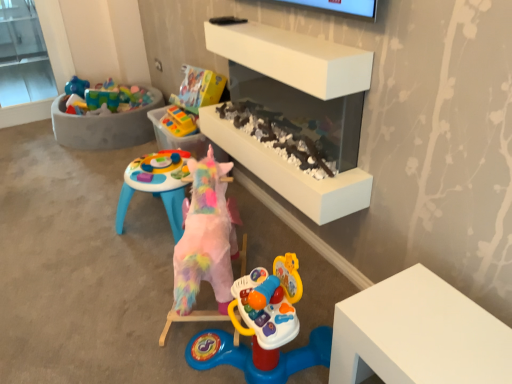
This screenshot has height=384, width=512. What do you see at coordinates (293, 58) in the screenshot?
I see `white matte fireplace at center` at bounding box center [293, 58].

What do you see at coordinates (205, 244) in the screenshot? I see `fuzzy pink unicorn at center, which is the second toy in back-to-front order` at bounding box center [205, 244].

Identify the location of white matte fireplace at center. (293, 58).

Locate an element on the screen. furniture that is on the left side of white matte fireplace at center is located at coordinates (104, 126).

Which object is closer to the camera, white matte fireplace at center or concrete tub at upper left?

white matte fireplace at center.

Considering the points (246, 144) and (151, 93), which point is in front, point (246, 144) or point (151, 93)?

Positioned in front is point (246, 144).

Does white matte fireplace at center have a lesser width compared to concrete tub at upper left?

Yes.

From a real-world perspective, which is physically below, fuzzy pink unicorn at center, positioned as the 1th toy in front-to-back order, or rubberized plastic toy at center, the 1th toy in the top-to-bottom sequence?

From a 3D spatial view, fuzzy pink unicorn at center, positioned as the 1th toy in front-to-back order, is below.

Is fuzzy pink unicorn at center, arranged as the first toy when ordered from the bottom, oriented towards rubberized plastic toy at center, the second toy positioned from the front?

No, fuzzy pink unicorn at center, arranged as the first toy when ordered from the bottom, does not turn towards rubberized plastic toy at center, the second toy positioned from the front.

Between fuzzy pink unicorn at center, positioned as the 1th toy in front-to-back order, and rubberized plastic toy at center, the 1th toy in the top-to-bottom sequence, which one has more height?

fuzzy pink unicorn at center, positioned as the 1th toy in front-to-back order, is taller.

Is fuzzy pink unicorn at center, positioned as the 1th toy in front-to-back order, to the left of rubberized plastic toy at center, which is the second toy from bottom to top, from the viewer's perspective?

In fact, fuzzy pink unicorn at center, positioned as the 1th toy in front-to-back order, is to the right of rubberized plastic toy at center, which is the second toy from bottom to top.

Which is less distant, (152, 92) or (266, 159)?

Clearly, point (152, 92) is more distant from the camera than point (266, 159).

Could white matte fireplace at center be considered to be inside concrete tub at upper left?

No, white matte fireplace at center is not surrounded by concrete tub at upper left.

Is concrete tub at upper left in front of white matte fireplace at center?

No, concrete tub at upper left is behind white matte fireplace at center.

Does concrete tub at upper left appear on the right side of white matte fireplace at center?

In fact, concrete tub at upper left is to the left of white matte fireplace at center.

From a real-world perspective, between fuzzy pink unicorn at center, the 2th toy when ordered from top to bottom, and concrete tub at upper left, who is vertically lower?

In real-world perspective, concrete tub at upper left is lower.

Consider the image. From the image's perspective, who appears lower, fuzzy pink unicorn at center, the 2th toy when ordered from top to bottom, or concrete tub at upper left?

From the image's view, fuzzy pink unicorn at center, the 2th toy when ordered from top to bottom, is below.

Who is more distant, fuzzy pink unicorn at center, positioned as the 1th toy in front-to-back order, or concrete tub at upper left?

Positioned behind is concrete tub at upper left.

Based on their sizes in the image, would you say concrete tub at upper left is bigger or smaller than fuzzy pink unicorn at center, the 2th toy when ordered from top to bottom?

Clearly, concrete tub at upper left is larger in size than fuzzy pink unicorn at center, the 2th toy when ordered from top to bottom.

What's the angular difference between concrete tub at upper left and fuzzy pink unicorn at center, the 2th toy when ordered from top to bottom,'s facing directions?

29.8 degrees separate the facing orientations of concrete tub at upper left and fuzzy pink unicorn at center, the 2th toy when ordered from top to bottom.

From the image's perspective, count 2nd toys downward from the concrete tub at upper left and point to it. Please provide its 2D coordinates.

[(205, 244)]

Looking at this image, is the surface of concrete tub at upper left in direct contact with fuzzy pink unicorn at center, positioned as the 1th toy in front-to-back order?

No, concrete tub at upper left is not making contact with fuzzy pink unicorn at center, positioned as the 1th toy in front-to-back order.

Is rubberized plastic toy at center, the second toy positioned from the front, located outside concrete tub at upper left?

Indeed, rubberized plastic toy at center, the second toy positioned from the front, is completely outside concrete tub at upper left.

Are rubberized plastic toy at center, which is the first toy in back-to-front order, and concrete tub at upper left making contact?

No, rubberized plastic toy at center, which is the first toy in back-to-front order, is not with concrete tub at upper left.

Measure the distance between rubberized plastic toy at center, which is the first toy in back-to-front order, and concrete tub at upper left.

They are 32.30 inches apart.

Locate an element on the screen. toy behind the white matte fireplace at center is located at coordinates (179, 122).

Considering the relative positions of white matte fireplace at center and rubberized plastic toy at center, which is the first toy in back-to-front order, in the image provided, is white matte fireplace at center to the left or to the right of rubberized plastic toy at center, which is the first toy in back-to-front order,?

From the image, it's evident that white matte fireplace at center is to the right of rubberized plastic toy at center, which is the first toy in back-to-front order.

From the image's perspective, is white matte fireplace at center beneath rubberized plastic toy at center, the second toy positioned from the front?

Yes, from the image's perspective, white matte fireplace at center is beneath rubberized plastic toy at center, the second toy positioned from the front.

Locate an element on the screen. Image resolution: width=512 pixels, height=384 pixels. furniture lying on the left of white matte fireplace at center is located at coordinates (104, 126).

Where is `toy lying in front of the rubberized plastic toy at center, the second toy positioned from the front`? Image resolution: width=512 pixels, height=384 pixels. toy lying in front of the rubberized plastic toy at center, the second toy positioned from the front is located at coordinates (205, 244).

Looking at this image, when comparing their distances from rubberized plastic toy at center, the second toy positioned from the front, does fuzzy pink unicorn at center, the 2th toy when ordered from top to bottom, or white matte fireplace at center seem further?

The object further to rubberized plastic toy at center, the second toy positioned from the front, is fuzzy pink unicorn at center, the 2th toy when ordered from top to bottom.

Based on their spatial positions, is rubberized plastic toy at center, which is the first toy in back-to-front order, or fuzzy pink unicorn at center, which is the second toy in back-to-front order, closer to white matte fireplace at center?

fuzzy pink unicorn at center, which is the second toy in back-to-front order.

Which object lies further to the anchor point fuzzy pink unicorn at center, arranged as the first toy when ordered from the bottom, white matte fireplace at center or rubberized plastic toy at center, the 1th toy in the top-to-bottom sequence?

The object further to fuzzy pink unicorn at center, arranged as the first toy when ordered from the bottom, is rubberized plastic toy at center, the 1th toy in the top-to-bottom sequence.

Looking at the image, which one is located closer to rubberized plastic toy at center, the second toy positioned from the front, concrete tub at upper left or fuzzy pink unicorn at center, which is the second toy in back-to-front order?

concrete tub at upper left is closer to rubberized plastic toy at center, the second toy positioned from the front.

When comparing their distances from fuzzy pink unicorn at center, arranged as the first toy when ordered from the bottom, does rubberized plastic toy at center, the 1th toy in the top-to-bottom sequence, or concrete tub at upper left seem further?

concrete tub at upper left.

Estimate the real-world distances between objects in this image. Which object is further from white matte fireplace at center, rubberized plastic toy at center, which is the second toy from bottom to top, or concrete tub at upper left?

Among the two, concrete tub at upper left is located further to white matte fireplace at center.

Estimate the real-world distances between objects in this image. Which object is further from fuzzy pink unicorn at center, the 2th toy when ordered from top to bottom, concrete tub at upper left or white matte fireplace at center?

concrete tub at upper left is further to fuzzy pink unicorn at center, the 2th toy when ordered from top to bottom.

When comparing their distances from fuzzy pink unicorn at center, the 2th toy when ordered from top to bottom, does white matte fireplace at center or concrete tub at upper left seem further?

Based on the image, concrete tub at upper left appears to be further to fuzzy pink unicorn at center, the 2th toy when ordered from top to bottom.

Where is `shelf between fuzzy pink unicorn at center, arranged as the first toy when ordered from the bottom, and rubberized plastic toy at center, which is the second toy from bottom to top, from front to back`? The image size is (512, 384). shelf between fuzzy pink unicorn at center, arranged as the first toy when ordered from the bottom, and rubberized plastic toy at center, which is the second toy from bottom to top, from front to back is located at coordinates (293, 58).

This screenshot has height=384, width=512. Identify the location of shelf between fuzzy pink unicorn at center, arranged as the first toy when ordered from the bottom, and concrete tub at upper left in the front-back direction. (293, 58).

Image resolution: width=512 pixels, height=384 pixels. Find the location of `toy between fuzzy pink unicorn at center, positioned as the 1th toy in front-to-back order, and concrete tub at upper left, along the z-axis`. toy between fuzzy pink unicorn at center, positioned as the 1th toy in front-to-back order, and concrete tub at upper left, along the z-axis is located at coordinates point(179,122).

Image resolution: width=512 pixels, height=384 pixels. In order to click on toy positioned between white matte fireplace at center and concrete tub at upper left from near to far in this screenshot , I will do `click(179, 122)`.